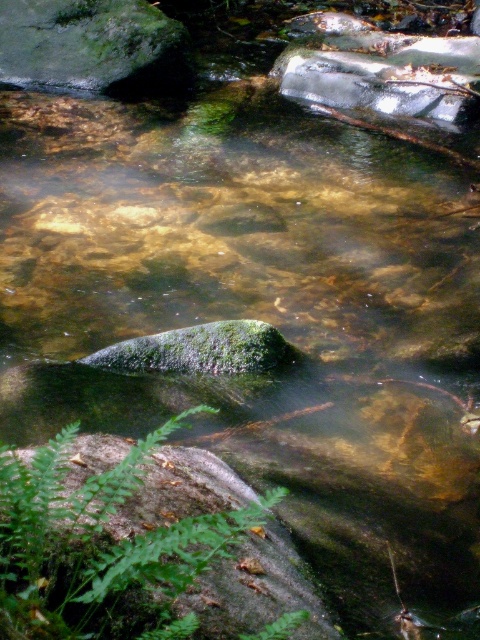
You are standing at the point marked as point (100, 547) in the image. What do you see immediately around you?

You see a green fuzzy fern at lower left immediately around you at point (100, 547).

You are a hiker looking at the stream. You see the green fuzzy fern at lower left and the green mossy rock at upper left. Which one is positioned more to the right side of the scene?

The green fuzzy fern at lower left is positioned to the right of the green mossy rock at upper left, so the green fuzzy fern at lower left is more to the right side of the scene.